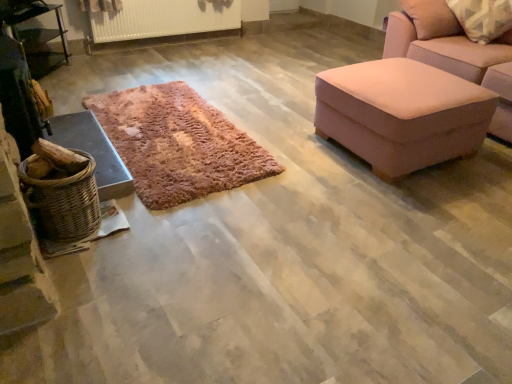
What do you see at coordinates (44, 45) in the screenshot?
I see `metallic silver table at left` at bounding box center [44, 45].

This screenshot has width=512, height=384. I want to click on woven brown basket at left, so click(63, 201).

I want to click on metallic silver table at left, so click(x=44, y=45).

Could you tell me if metallic silver table at left is turned towards woven wood basket at left?

No.

Is metallic silver table at left far from woven wood basket at left?

metallic silver table at left is positioned a significant distance from woven wood basket at left.

Does point (34, 202) appear closer or farther from the camera than point (65, 140)?

Clearly, point (34, 202) is closer to the camera than point (65, 140).

Considering the relative sizes of woven brown basket at left and woven wood basket at left in the image provided, is woven brown basket at left wider than woven wood basket at left?

In fact, woven brown basket at left might be narrower than woven wood basket at left.

Which of these two, woven brown basket at left or woven wood basket at left, stands shorter?

woven wood basket at left.

From the image's perspective, is woven brown basket at left on woven wood basket at left?

Incorrect, from the image's perspective, woven brown basket at left is lower than woven wood basket at left.

In the scene shown: Is metallic silver table at left not near woven brown basket at left?

metallic silver table at left is far away from woven brown basket at left.

From the image's perspective, which is below, metallic silver table at left or woven brown basket at left?

woven brown basket at left is shown below in the image.

Is metallic silver table at left oriented towards woven brown basket at left?

No, metallic silver table at left does not turn towards woven brown basket at left.

Would you say woven wood basket at left is to the left or to the right of woven brown basket at left in the picture?

In the image, woven wood basket at left appears on the left side of woven brown basket at left.

I want to click on furniture lying above the woven brown basket at left (from the image's perspective), so click(x=92, y=151).

Considering the positions of points (115, 181) and (63, 225), is point (115, 181) closer to camera compared to point (63, 225)?

That is False.

Can we say woven wood basket at left lies outside woven brown basket at left?

woven wood basket at left lies outside woven brown basket at left's area.

Identify the location of table above the woven wood basket at left (from a real-world perspective). The width and height of the screenshot is (512, 384). (44, 45).

Considering the positions of point (112, 159) and point (37, 30), is point (112, 159) closer or farther from the camera than point (37, 30)?

Point (112, 159) is positioned closer to the camera compared to point (37, 30).

Is woven wood basket at left facing away from metallic silver table at left?

Correct, woven wood basket at left is looking away from metallic silver table at left.

In the image, is woven wood basket at left on the left side or the right side of metallic silver table at left?

Based on their positions, woven wood basket at left is located to the right of metallic silver table at left.

Consider the image. Is woven brown basket at left positioned with its back to metallic silver table at left?

No, woven brown basket at left is not facing away from metallic silver table at left.

Is woven brown basket at left inside or outside of metallic silver table at left?

woven brown basket at left lies outside metallic silver table at left.

Does woven brown basket at left have a lesser width compared to metallic silver table at left?

In fact, woven brown basket at left might be wider than metallic silver table at left.

Considering the positions of points (64, 228) and (27, 50), is point (64, 228) farther from camera compared to point (27, 50)?

No, it is in front of (27, 50).

At what (x,y) coordinates should I click in order to perform the action: click on table that is on the left side of woven wood basket at left. Please return your answer as a coordinate pair (x, y). Looking at the image, I should click on (44, 45).

Where is `basket lying below the woven wood basket at left (from the image's perspective)`? The image size is (512, 384). basket lying below the woven wood basket at left (from the image's perspective) is located at coordinates (63, 201).

When comparing their distances from metallic silver table at left, does woven brown basket at left or woven wood basket at left seem closer?

Among the two, woven wood basket at left is located nearer to metallic silver table at left.

Based on their spatial positions, is woven wood basket at left or woven brown basket at left further from metallic silver table at left?

The object further to metallic silver table at left is woven brown basket at left.

Based on their spatial positions, is metallic silver table at left or woven wood basket at left further from woven brown basket at left?

The object further to woven brown basket at left is metallic silver table at left.

Looking at the image, which one is located closer to woven brown basket at left, woven wood basket at left or metallic silver table at left?

woven wood basket at left is closer to woven brown basket at left.

Which object lies further to the anchor point woven wood basket at left, woven brown basket at left or metallic silver table at left?

The object further to woven wood basket at left is metallic silver table at left.

From the picture: Looking at the image, which one is located further to woven wood basket at left, metallic silver table at left or woven brown basket at left?

The object further to woven wood basket at left is metallic silver table at left.

Where is `furniture positioned between woven brown basket at left and metallic silver table at left from near to far`? This screenshot has height=384, width=512. furniture positioned between woven brown basket at left and metallic silver table at left from near to far is located at coordinates (92, 151).